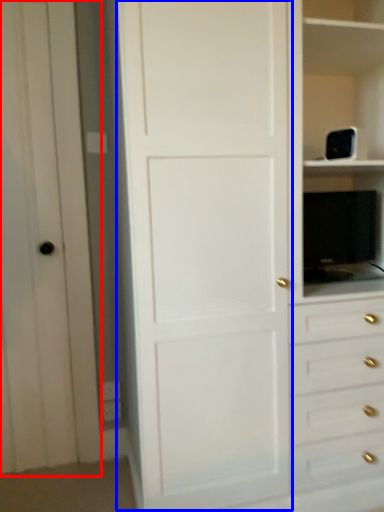
Question: Which object is further to the camera taking this photo, glass door (highlighted by a red box) or door (highlighted by a blue box)?

Choices:
 (A) glass door
 (B) door

Answer: (A)